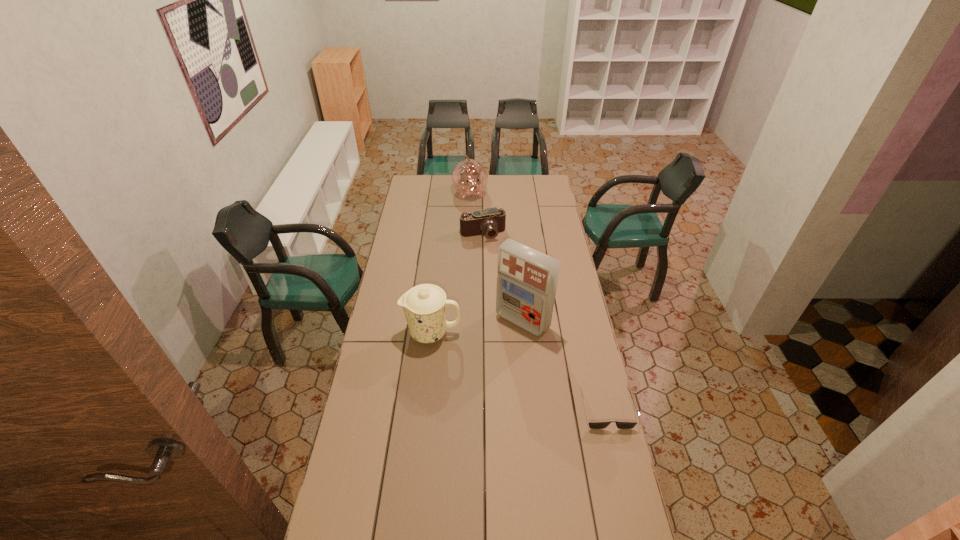
Locate an element on the screen. This screenshot has height=540, width=960. free space between the first-aid kit and the nearest object is located at coordinates pyautogui.click(x=564, y=366).

Locate which object is the third closest to the rightmost object. Please provide its 2D coordinates. Your answer should be formatted as a tuple, i.e. [(x, y)], where the tuple contains the x and y coordinates of a point satisfying the conditions above.

[(491, 221)]

Locate which object is the fourth closest to the farthest object. Please provide its 2D coordinates. Your answer should be formatted as a tuple, i.e. [(x, y)], where the tuple contains the x and y coordinates of a point satisfying the conditions above.

[(592, 425)]